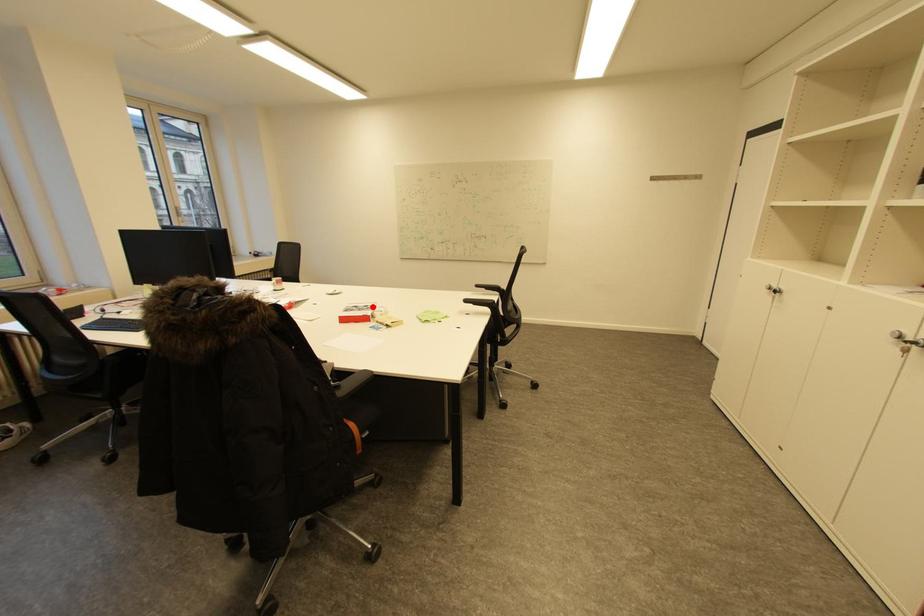
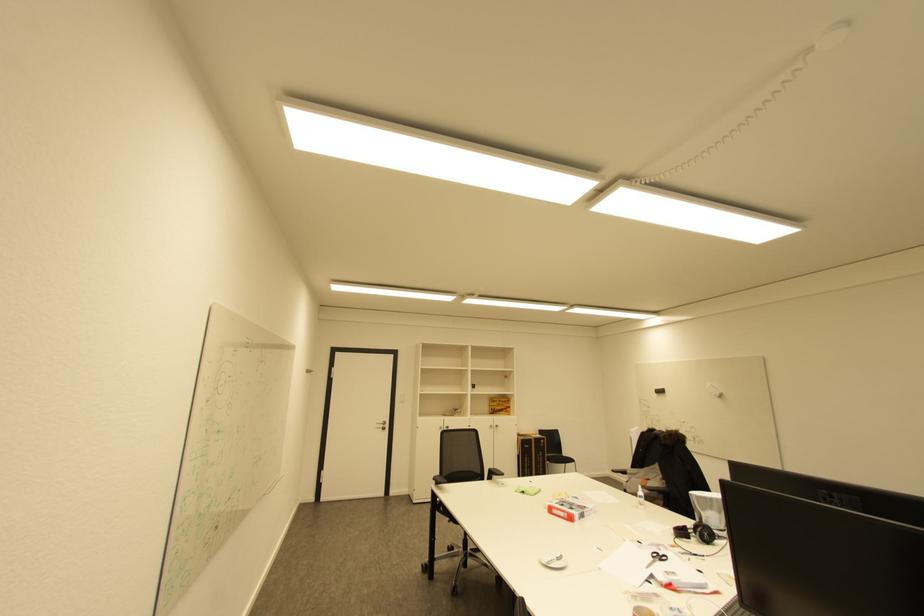
Question: I am providing you with two images of the same scene from different viewpoints. A red point is marked on the first image. At the location where the point appears in image 1, is it still visible in image 2?

Choices:
 (A) Yes
 (B) No

Answer: (A)